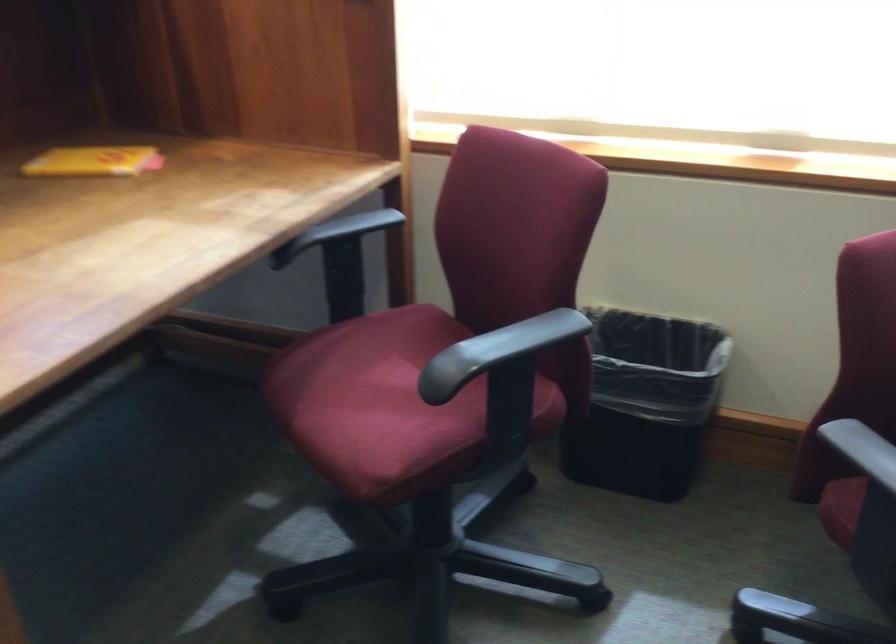
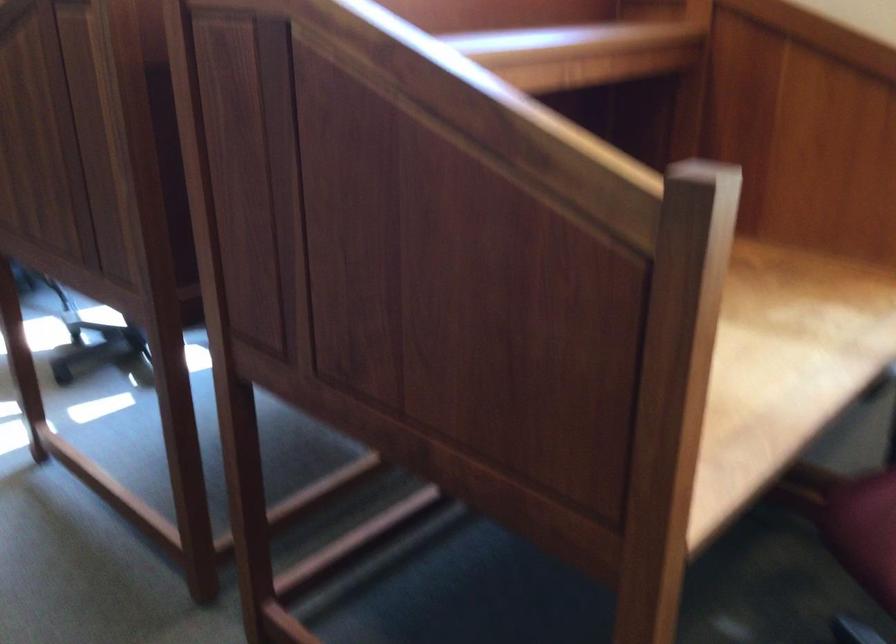
Question: Which direction would the cameraman need to move to produce the second image? Reply with the corresponding letter.

Choices:
 (A) Left
 (B) Right
 (C) Forward
 (D) Backward

Answer: (A)